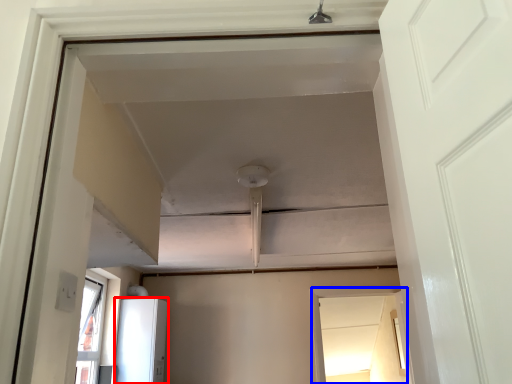
Question: Among these objects, which one is nearest to the camera, appliance (highlighted by a red box) or window (highlighted by a blue box)?

Choices:
 (A) appliance
 (B) window

Answer: (A)